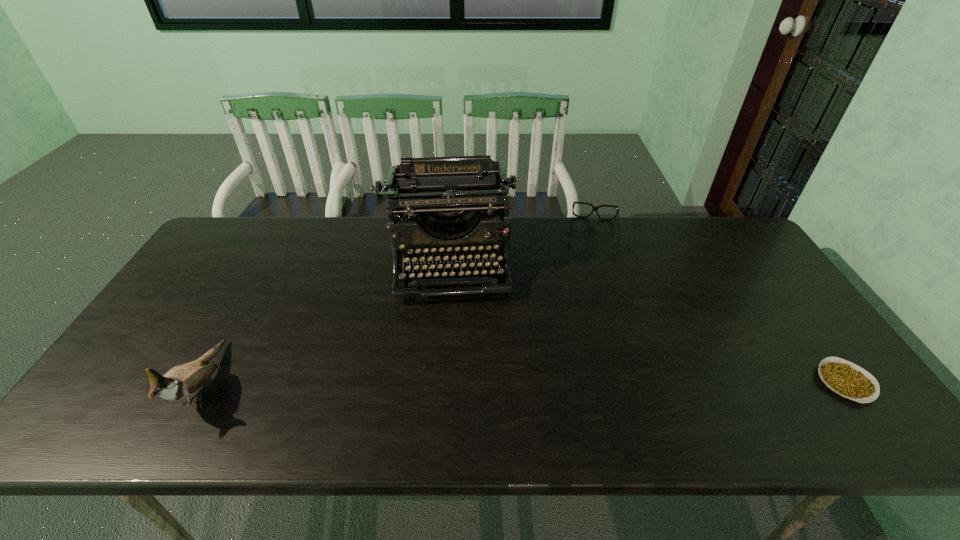
Locate an element on the screen. vacant space in between the rightmost object and the second object from left to right is located at coordinates (647, 322).

Find the location of `empty location between the third tallest object and the second tallest object`. empty location between the third tallest object and the second tallest object is located at coordinates (399, 309).

The width and height of the screenshot is (960, 540). Identify the location of vacant area between the bird and the third object from left to right. (399, 309).

Identify the location of free spot between the leftmost object and the shortest object. (525, 383).

Locate an element on the screen. The height and width of the screenshot is (540, 960). blank region between the bird and the second object from right to left is located at coordinates (399, 309).

Locate an element on the screen. This screenshot has width=960, height=540. free space between the leftmost object and the tallest object is located at coordinates (326, 323).

The image size is (960, 540). Identify the location of object that stands as the third closest to the legume. (182, 381).

Identify which object is located as the second nearest to the rightmost object. Please provide its 2D coordinates. Your answer should be formatted as a tuple, i.e. [(x, y)], where the tuple contains the x and y coordinates of a point satisfying the conditions above.

[(448, 193)]

Locate an element on the screen. free spot that satisfies the following two spatial constraints: 1. on the front side of the rightmost object; 2. on the left side of the third tallest object is located at coordinates (640, 382).